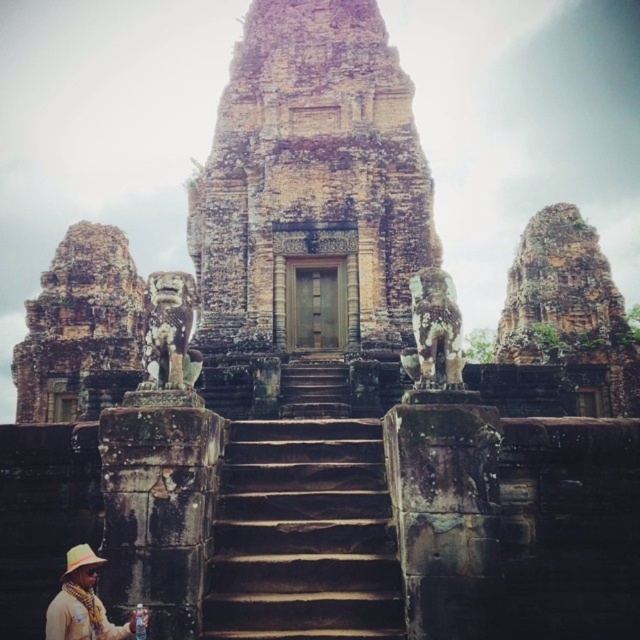
You are standing in front of the brown stone temple at center and want to reach the entrance. Which direction should you move relative to the brown stone stairs at center to approach the temple?

Since the brown stone temple at center is further to the viewer than the brown stone stairs at center, you should move towards the stairs to approach the temple as they lead up to it.

You are an archaeologist examining the temple ruins and notice two hats at the lower left corner of the scene. Which hat is positioned more to the right between the tan woven hat at lower left and the straw hat at lower left?

The tan woven hat at lower left is positioned more to the right compared to the straw hat at lower left.

You are standing at a point 94.85 meters away from the temple entrance. The temple entrance is marked by point (273, 33). Can you estimate how far you are from the entrance?

You are 94.85 meters away from the temple entrance marked by point (273, 33).